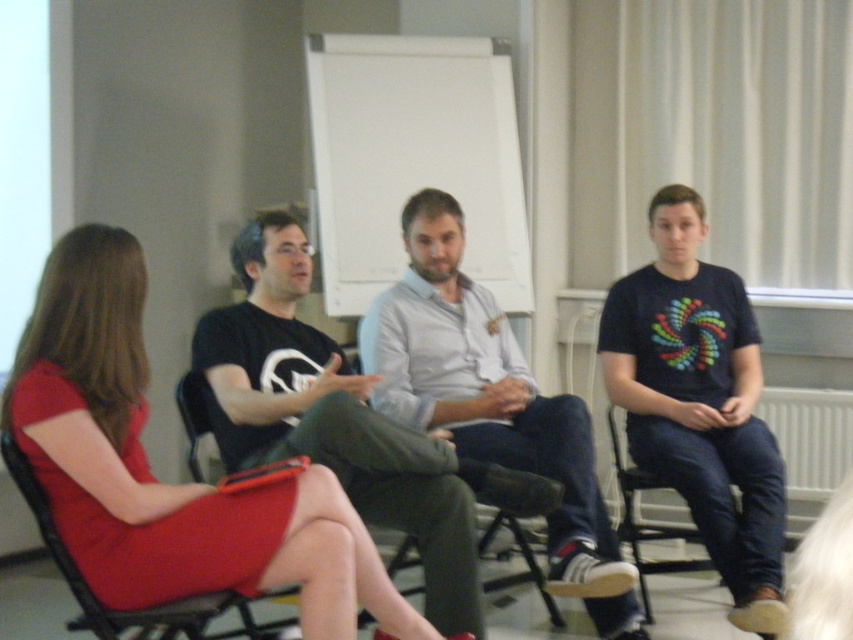
Who is positioned more to the right, matte red dress at center or black fabric chair at lower right?

From the viewer's perspective, black fabric chair at lower right appears more on the right side.

Can you confirm if matte red dress at center is positioned to the right of black fabric chair at lower right?

In fact, matte red dress at center is to the left of black fabric chair at lower right.

Find the location of `matte red dress at center`. matte red dress at center is located at coordinates click(164, 483).

Between dark blue t-shirt at center and velvet red armchair at left, which one appears on the left side from the viewer's perspective?

velvet red armchair at left

The height and width of the screenshot is (640, 853). Describe the element at coordinates (700, 403) in the screenshot. I see `dark blue t-shirt at center` at that location.

This screenshot has height=640, width=853. What are the coordinates of `dark blue t-shirt at center` in the screenshot? It's located at (700, 403).

Between point (202, 612) and point (645, 586), which one is positioned behind?

The point (645, 586) is more distant.

Which is more to the right, velvet red armchair at left or black fabric chair at lower right?

black fabric chair at lower right is more to the right.

This screenshot has height=640, width=853. Describe the element at coordinates (91, 592) in the screenshot. I see `velvet red armchair at left` at that location.

The width and height of the screenshot is (853, 640). Identify the location of velvet red armchair at left. (91, 592).